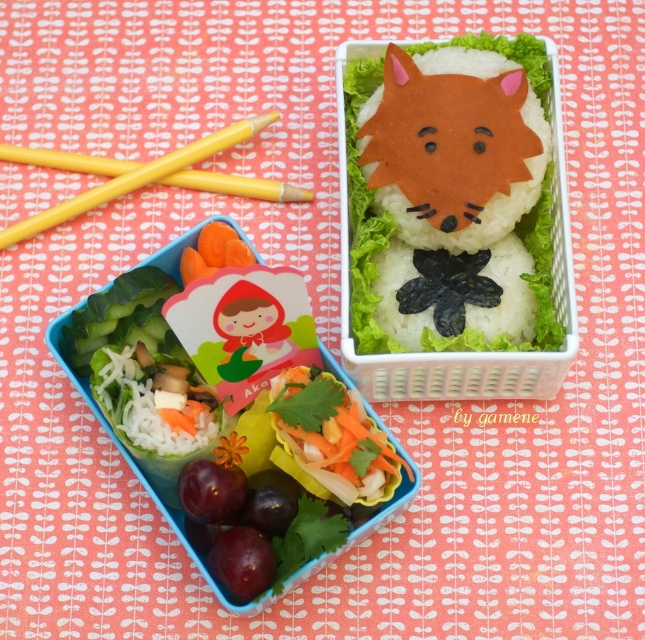
Looking at this image, you are a food critic examining the two bento boxes on the vibrant red tablecloth. In the bento box on the left, which contains both the orange matte rice fox at upper center and the white rice with seaweed at upper center, which one is located to the right of the other?

The orange matte rice fox at upper center is positioned on the right side of white rice with seaweed at upper center.

You are a food delivery person who needs to place a small spoon between the orange matte rice fox at upper center and the yellow plastic chopsticks at upper left. Can you fit it there without moving either object? The spoon is 2 inches long.

The orange matte rice fox at upper center is 11.95 inches from the yellow plastic chopsticks at upper left. Since the spoon is only 2 inches long, there is enough space to place it between them without moving either object.

You are looking at the two bento boxes on the vibrant red tablecloth. The first bento box on the left has an orange matte rice fox at upper center and white rice with seaweed at upper center. Which of these two items is shorter?

The orange matte rice fox at upper center is not as tall as the white rice with seaweed at upper center, so the orange matte rice fox at upper center is shorter.